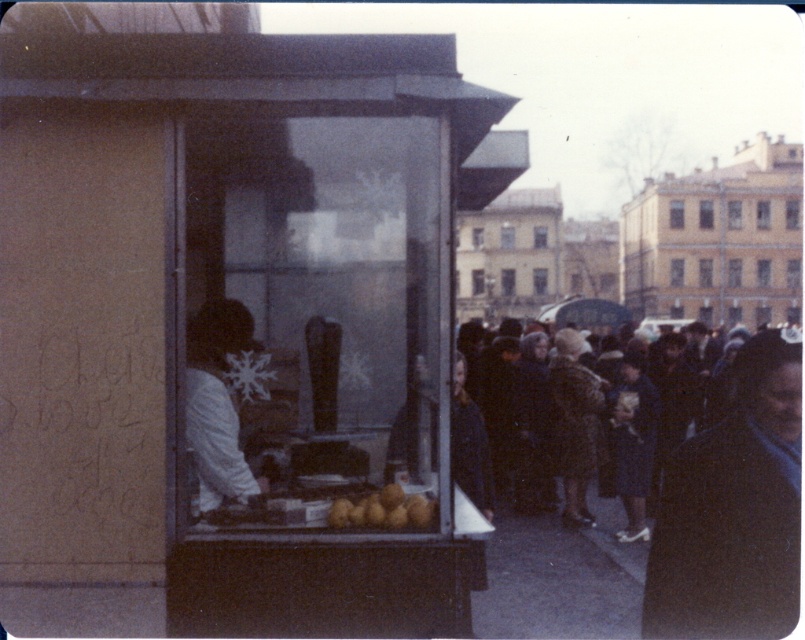
Is dark wool coat at right wider than dark gray coat at center?

Yes.

Is point (764, 580) positioned before point (452, 476)?

Yes, point (764, 580) is closer to viewer.

Who is more distant from viewer, (746, 637) or (459, 353)?

Positioned behind is point (459, 353).

Where is `dark wool coat at right`? The height and width of the screenshot is (640, 805). dark wool coat at right is located at coordinates (733, 509).

Between point (787, 518) and point (407, 518), which one is positioned behind?

The point (407, 518) is more distant.

Can you confirm if dark wool coat at right is positioned below yellow matte potatoes at center?

Actually, dark wool coat at right is above yellow matte potatoes at center.

Between point (733, 582) and point (413, 493), which one is positioned in front?

Point (733, 582) is more forward.

This screenshot has width=805, height=640. Find the location of `dark wool coat at right`. dark wool coat at right is located at coordinates (733, 509).

Between dark gray coat at center and yellow matte potatoes at center, which one has less height?

With less height is yellow matte potatoes at center.

Measure the distance from dark gray coat at center to yellow matte potatoes at center.

dark gray coat at center is 5.49 feet away from yellow matte potatoes at center.

The height and width of the screenshot is (640, 805). What are the coordinates of `dark gray coat at center` in the screenshot? It's located at (469, 444).